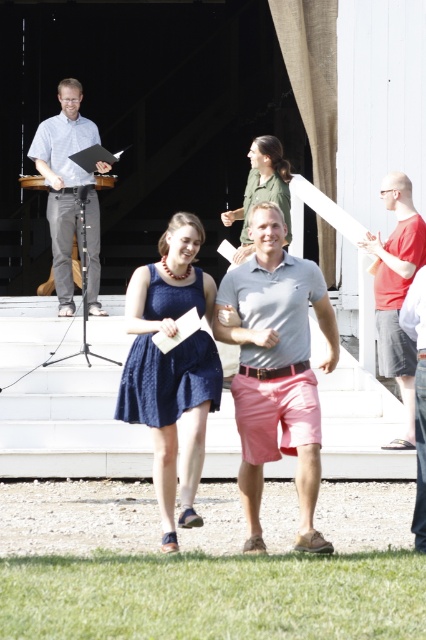
Based on the coordinates provided, which object corresponds to the point at location (172, 369) in the image?

The point at location (172, 369) corresponds to the navy blue dress at center.

You are a photographer at the event and want to capture a photo where both the gray cotton polo shirt at center and the navy blue dress at center are clearly visible. Based on their positions, which one should you focus on first to ensure both are in frame?

The gray cotton polo shirt at center is located above the navy blue dress at center, so you should focus on the navy blue dress at center first to ensure both are in frame.

You are a photographer at the event and need to capture a photo of both the gray cotton polo shirt at center and the navy blue dress at center. The camera you are using has a maximum focus range of 15 inches. Can you fit both subjects within the camera focus range without moving the camera?

The gray cotton polo shirt at center is 16.10 inches from the navy blue dress at center, which exceeds the camera focus range of 15 inches. Therefore, you cannot fit both subjects within the camera focus range without moving the camera.